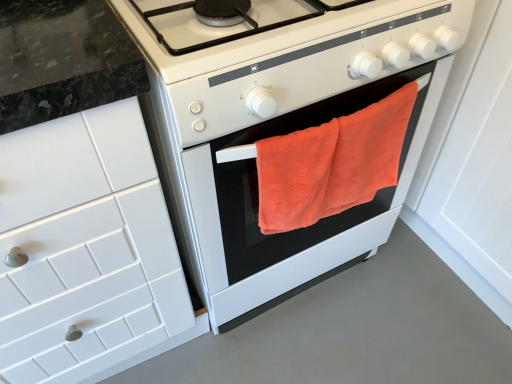
Describe the element at coordinates (298, 229) in the screenshot. Image resolution: width=512 pixels, height=384 pixels. I see `orange towel at center` at that location.

This screenshot has width=512, height=384. What are the coordinates of `orange terry cloth towel at center` in the screenshot? It's located at (331, 164).

What is the approximate height of orange terry cloth towel at center?

The height of orange terry cloth towel at center is 11.93 inches.

At what (x,y) coordinates should I click in order to perform the action: click on orange towel at center. Please return your answer as a coordinate pair (x, y). Looking at the image, I should click on (298, 229).

Considering the sizes of objects white tile cabinet at left and orange terry cloth towel at center in the image provided, who is wider, white tile cabinet at left or orange terry cloth towel at center?

white tile cabinet at left is wider.

What are the coordinates of `beach towel that is above the white tile cabinet at left (from a real-world perspective)` in the screenshot? It's located at (331, 164).

Would you say orange terry cloth towel at center is part of white tile cabinet at left's contents?

No, orange terry cloth towel at center is located outside of white tile cabinet at left.

Who is bigger, white tile cabinet at left or orange terry cloth towel at center?

white tile cabinet at left.

Looking at this image, is orange terry cloth towel at center turned away from white tile cabinet at left?

Answer: orange terry cloth towel at center does not have its back to white tile cabinet at left.

Which point is more distant from viewer, (x=317, y=194) or (x=25, y=358)?

The point (x=25, y=358) is more distant.

Locate an element on the screen. This screenshot has width=512, height=384. cabinetry below the orange terry cloth towel at center (from a real-world perspective) is located at coordinates (86, 249).

From the image's perspective, which object appears higher, orange terry cloth towel at center or orange towel at center?

orange towel at center.

From a real-world perspective, which object rests below the other?

orange towel at center, from a real-world perspective.

At what (x,y) coordinates should I click in order to perform the action: click on beach towel above the orange towel at center (from a real-world perspective). Please return your answer as a coordinate pair (x, y). The image size is (512, 384). Looking at the image, I should click on (331, 164).

Is white tile cabinet at left shorter than orange towel at center?

No.

There is a orange towel at center. At what (x,y) coordinates should I click in order to perform the action: click on cabinetry above it (from a real-world perspective). Please return your answer as a coordinate pair (x, y). Looking at the image, I should click on (86, 249).

Considering the relative positions of white tile cabinet at left and orange towel at center in the image provided, is white tile cabinet at left to the right of orange towel at center from the viewer's perspective?

In fact, white tile cabinet at left is to the left of orange towel at center.

Which object is wider, white tile cabinet at left or orange towel at center?

orange towel at center is wider.

Would you say orange towel at center is to the left or to the right of white tile cabinet at left in the picture?

Clearly, orange towel at center is on the right of white tile cabinet at left in the image.

Considering the positions of objects orange towel at center and white tile cabinet at left in the image provided, who is behind, orange towel at center or white tile cabinet at left?

Positioned behind is orange towel at center.

Looking at their sizes, would you say orange towel at center is wider or thinner than white tile cabinet at left?

Clearly, orange towel at center has more width compared to white tile cabinet at left.

Considering the positions of objects orange towel at center and orange terry cloth towel at center in the image provided, who is in front, orange towel at center or orange terry cloth towel at center?

Positioned in front is orange towel at center.

Based on the photo, is orange towel at center placed right next to orange terry cloth towel at center?

No, orange towel at center is not beside orange terry cloth towel at center.

Image resolution: width=512 pixels, height=384 pixels. What are the coordinates of `beach towel below the orange towel at center (from the image's perspective)` in the screenshot? It's located at (331, 164).

From a real-world perspective, is orange towel at center positioned above or below orange terry cloth towel at center?

orange towel at center is below orange terry cloth towel at center.

At what (x,y) coordinates should I click in order to perform the action: click on cabinetry in front of the orange terry cloth towel at center. Please return your answer as a coordinate pair (x, y). Looking at the image, I should click on (86, 249).

Where is `beach towel on the right of white tile cabinet at left`? The width and height of the screenshot is (512, 384). beach towel on the right of white tile cabinet at left is located at coordinates (331, 164).

Based on their spatial positions, is orange towel at center or white tile cabinet at left further from orange terry cloth towel at center?

Among the two, white tile cabinet at left is located further to orange terry cloth towel at center.

Based on their spatial positions, is orange towel at center or orange terry cloth towel at center closer to white tile cabinet at left?

orange towel at center is positioned closer to the anchor white tile cabinet at left.

Which object lies further to the anchor point orange towel at center, orange terry cloth towel at center or white tile cabinet at left?

white tile cabinet at left is positioned further to the anchor orange towel at center.

Looking at the image, which one is located closer to orange towel at center, white tile cabinet at left or orange terry cloth towel at center?

orange terry cloth towel at center is closer to orange towel at center.

Estimate the real-world distances between objects in this image. Which object is closer to white tile cabinet at left, orange terry cloth towel at center or orange towel at center?

orange towel at center is closer to white tile cabinet at left.

From the image, which object appears to be farther from orange terry cloth towel at center, white tile cabinet at left or orange towel at center?

Among the two, white tile cabinet at left is located further to orange terry cloth towel at center.

This screenshot has width=512, height=384. Identify the location of oven between white tile cabinet at left and orange terry cloth towel at center. (298, 229).